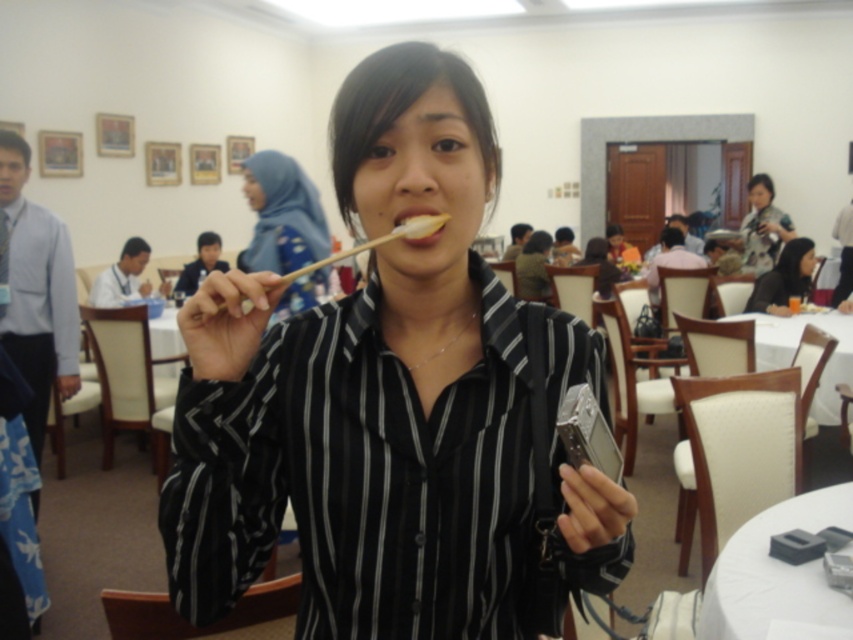
Question: Among these objects, which one is farthest from the camera?

Choices:
 (A) blue fabric hijab at upper center
 (B) patterned fabric scarf at upper right

Answer: (B)

Question: Does black striped shirt at center lie in front of black fabric shirt at center?

Choices:
 (A) yes
 (B) no

Answer: (A)

Question: Which object is closer to the camera taking this photo?

Choices:
 (A) blue fabric hijab at upper center
 (B) patterned fabric scarf at upper right

Answer: (A)

Question: Can you confirm if blue fabric hijab at upper center is wider than patterned fabric scarf at upper right?

Choices:
 (A) yes
 (B) no

Answer: (B)

Question: Estimate the real-world distances between objects in this image. Which object is farther from the black fabric shirt at center?

Choices:
 (A) blue fabric hijab at upper center
 (B) patterned fabric scarf at upper right
 (C) black striped shirt at center

Answer: (C)

Question: Does black striped shirt at center appear on the right side of patterned fabric scarf at upper right?

Choices:
 (A) no
 (B) yes

Answer: (A)